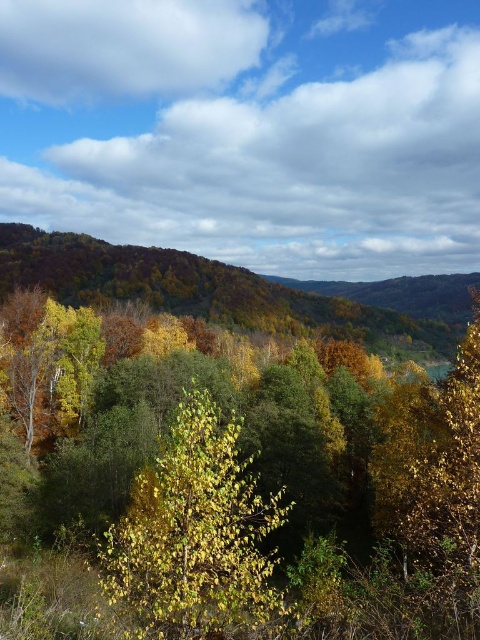
Is point (432, 536) farther from viewer compared to point (239, 563)?

Yes, it is behind point (239, 563).

Does yellow-green foliage at center appear on the right side of yellow-green leaves at center?

No, yellow-green foliage at center is not to the right of yellow-green leaves at center.

Locate an element on the screen. The width and height of the screenshot is (480, 640). yellow-green foliage at center is located at coordinates (252, 484).